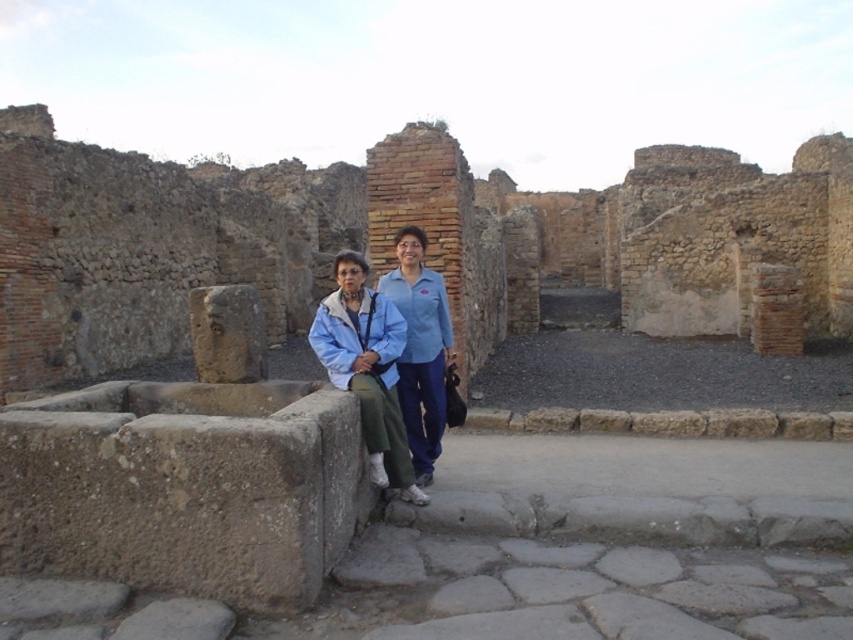
Looking at this image, you are a tour guide leading visitors through an archaeological site. You notice two points marked on the map as point 1 and point 2. The first point is located at coordinates (74, 317) and the second at (410, 467). If you want to guide visitors to the nearest point to the entrance, which point should you direct them to first?

Point 1 is closer to the entrance because it is further to the viewer than point 2, which is located further away.

You are a tour guide at the archaeological site and want to point out the brick wall at center to a visitor. Which direction should you indicate relative to the blue fabric jacket at center?

The brick wall at center is positioned on the left side of the blue fabric jacket at center, so you should indicate the left direction relative to the blue fabric jacket at center.

You are a tour guide at this archaeological site and need to ensure visitors can safely walk between the brick wall at center and the blue fabric jacket at center. Based on their positions, which object is higher and could potentially block the view for someone walking through?

The brick wall at center is above the blue fabric jacket at center, so it is higher and could block the view for someone walking through.